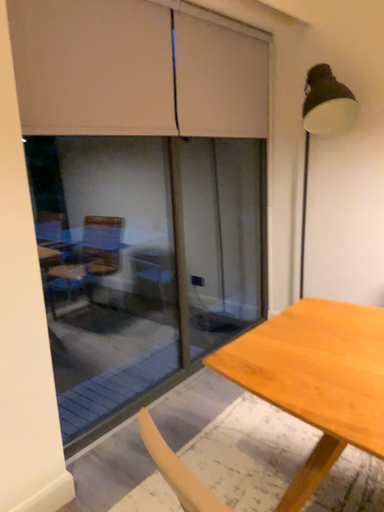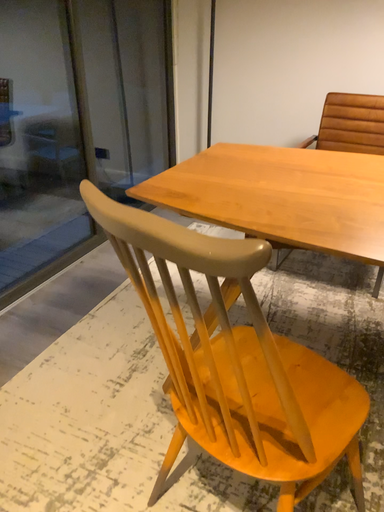
Question: Which way did the camera rotate in the video?

Choices:
 (A) rotated downward
 (B) rotated upward

Answer: (A)